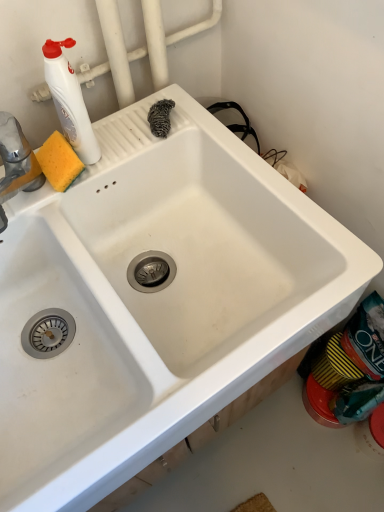
The image size is (384, 512). Describe the element at coordinates (69, 101) in the screenshot. I see `white plastic bottle at upper left` at that location.

The image size is (384, 512). I want to click on white plastic bottle at upper left, so (x=69, y=101).

What is the approximate height of white plastic bottle at upper left?

The height of white plastic bottle at upper left is 9.89 inches.

Where is `white plastic bottle at upper left`? white plastic bottle at upper left is located at coordinates (69, 101).